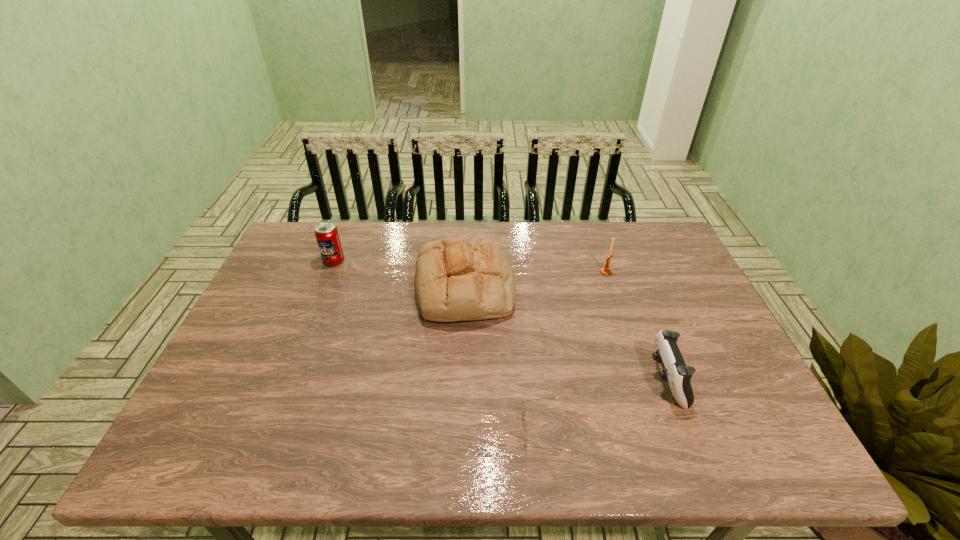
Find the location of a particular element. This screenshot has height=540, width=960. free space between the soda can and the control is located at coordinates pyautogui.click(x=500, y=320).

Where is `vacant area that lies between the bread and the candle_holder`? The image size is (960, 540). vacant area that lies between the bread and the candle_holder is located at coordinates (535, 280).

The height and width of the screenshot is (540, 960). Identify the location of blank region between the bread and the control. coord(565,334).

The width and height of the screenshot is (960, 540). I want to click on unoccupied area between the rightmost object and the bread, so click(565, 334).

Identify the location of vacant space that's between the soda can and the bread. (399, 275).

Where is `object identified as the third closest to the second object from right to left`? object identified as the third closest to the second object from right to left is located at coordinates (523, 407).

Select which object appears as the fourth closest to the fourth object from left to right. Please provide its 2D coordinates. Your answer should be formatted as a tuple, i.e. [(x, y)], where the tuple contains the x and y coordinates of a point satisfying the conditions above.

[(327, 236)]